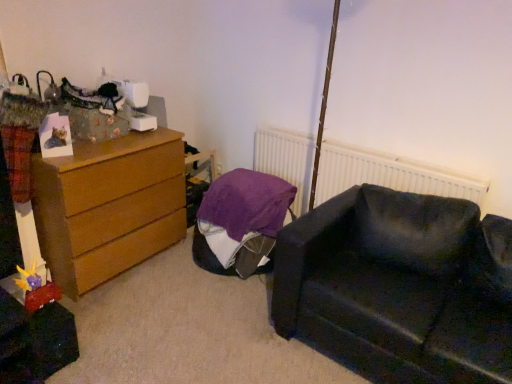
The height and width of the screenshot is (384, 512). Describe the element at coordinates (36, 289) in the screenshot. I see `plush yellow and purple toy at lower left` at that location.

Image resolution: width=512 pixels, height=384 pixels. What are the coordinates of `plush yellow and purple toy at lower left` in the screenshot? It's located at (36, 289).

Could you measure the distance between plush yellow and purple toy at lower left and white textured radiator at upper center?

plush yellow and purple toy at lower left and white textured radiator at upper center are 5.15 feet apart.

Can you confirm if plush yellow and purple toy at lower left is wider than white textured radiator at upper center?

Yes.

Image resolution: width=512 pixels, height=384 pixels. I want to click on toy beneath the white textured radiator at upper center (from a real-world perspective), so click(x=36, y=289).

In the image, is plush yellow and purple toy at lower left positioned in front of or behind white textured radiator at upper center?

plush yellow and purple toy at lower left is in front of white textured radiator at upper center.

Is purple fabric bean bag at center to the left or to the right of wooden chest of drawers at left in the image?

In the image, purple fabric bean bag at center appears on the right side of wooden chest of drawers at left.

Does purple fabric bean bag at center turn towards wooden chest of drawers at left?

No, purple fabric bean bag at center is not turned towards wooden chest of drawers at left.

Is point (212, 234) behind point (139, 151)?

Yes, it is behind point (139, 151).

Are purple fabric bean bag at center and wooden chest of drawers at left far apart?

No, purple fabric bean bag at center is in close proximity to wooden chest of drawers at left.

From the image's perspective, which one is positioned higher, dark fabric couch at lower right or white textured radiator at upper center?

From the image's view, white textured radiator at upper center is above.

Is dark fabric couch at lower right not near white textured radiator at upper center?

No, dark fabric couch at lower right is in close proximity to white textured radiator at upper center.

How many degrees apart are the facing directions of dark fabric couch at lower right and white textured radiator at upper center?

The angular difference between dark fabric couch at lower right and white textured radiator at upper center is 1.44 degrees.

From a real-world perspective, relative to white textured radiator at upper center, is dark fabric couch at lower right vertically above or below?

In terms of real-world spatial position, dark fabric couch at lower right is below white textured radiator at upper center.

This screenshot has height=384, width=512. In the image, there is a wooden chest of drawers at left. Find the location of `radiator above it (from the image's perspective)`. radiator above it (from the image's perspective) is located at coordinates (389, 174).

Which is behind, white textured radiator at upper center or wooden chest of drawers at left?

white textured radiator at upper center is further from the camera.

Is white textured radiator at upper center bigger or smaller than wooden chest of drawers at left?

Considering their sizes, white textured radiator at upper center takes up less space than wooden chest of drawers at left.

Is white textured radiator at upper center oriented towards wooden chest of drawers at left?

Yes.

Does plush yellow and purple toy at lower left contain wooden chest of drawers at left?

That's incorrect, wooden chest of drawers at left is not inside plush yellow and purple toy at lower left.

Is plush yellow and purple toy at lower left smaller than wooden chest of drawers at left?

Yes, plush yellow and purple toy at lower left is smaller than wooden chest of drawers at left.

Locate an element on the screen. The height and width of the screenshot is (384, 512). chest of drawers above the plush yellow and purple toy at lower left (from a real-world perspective) is located at coordinates (x=109, y=206).

Is plush yellow and purple toy at lower left further to camera compared to wooden chest of drawers at left?

No, the depth of plush yellow and purple toy at lower left is less than that of wooden chest of drawers at left.

Is purple fabric bean bag at center to the left or to the right of dark fabric couch at lower right in the image?

purple fabric bean bag at center is positioned on dark fabric couch at lower right's left side.

Considering the positions of objects purple fabric bean bag at center and dark fabric couch at lower right in the image provided, who is in front, purple fabric bean bag at center or dark fabric couch at lower right?

Positioned in front is dark fabric couch at lower right.

Does point (284, 201) come behind point (404, 239)?

Yes, it is.

In terms of height, does purple fabric bean bag at center look taller or shorter compared to dark fabric couch at lower right?

In the image, purple fabric bean bag at center appears to be shorter than dark fabric couch at lower right.

Which of these two, dark fabric couch at lower right or purple fabric bean bag at center, is bigger?

Bigger between the two is dark fabric couch at lower right.

From a real-world perspective, which object rests below the other?

purple fabric bean bag at center.

How many degrees apart are the facing directions of dark fabric couch at lower right and purple fabric bean bag at center?

They differ by 1.04 degrees in their facing directions.

Considering the relative sizes of dark fabric couch at lower right and purple fabric bean bag at center in the image provided, is dark fabric couch at lower right wider than purple fabric bean bag at center?

Yes.

Where is `toy lying on the left of white textured radiator at upper center`? This screenshot has width=512, height=384. toy lying on the left of white textured radiator at upper center is located at coordinates (36, 289).

At what (x,y) coordinates should I click in order to perform the action: click on bean bag chair directly beneath the wooden chest of drawers at left (from a real-world perspective). Please return your answer as a coordinate pair (x, y). Looking at the image, I should click on (242, 219).

From the image, which object appears to be farther from white textured radiator at upper center, wooden chest of drawers at left or purple fabric bean bag at center?

The object further to white textured radiator at upper center is wooden chest of drawers at left.

Based on their spatial positions, is purple fabric bean bag at center or wooden chest of drawers at left closer to white textured radiator at upper center?

Among the two, purple fabric bean bag at center is located nearer to white textured radiator at upper center.

Considering their positions, is white textured radiator at upper center positioned further to plush yellow and purple toy at lower left than wooden chest of drawers at left?

white textured radiator at upper center is positioned further to the anchor plush yellow and purple toy at lower left.

Considering their positions, is dark fabric couch at lower right positioned closer to purple fabric bean bag at center than plush yellow and purple toy at lower left?

Among the two, dark fabric couch at lower right is located nearer to purple fabric bean bag at center.

Considering their positions, is white textured radiator at upper center positioned closer to dark fabric couch at lower right than plush yellow and purple toy at lower left?

white textured radiator at upper center lies closer to dark fabric couch at lower right than the other object.

Estimate the real-world distances between objects in this image. Which object is further from purple fabric bean bag at center, plush yellow and purple toy at lower left or dark fabric couch at lower right?

Based on the image, plush yellow and purple toy at lower left appears to be further to purple fabric bean bag at center.

Which object lies nearer to the anchor point dark fabric couch at lower right, white textured radiator at upper center or wooden chest of drawers at left?

white textured radiator at upper center is positioned closer to the anchor dark fabric couch at lower right.

From the image, which object appears to be nearer to white textured radiator at upper center, plush yellow and purple toy at lower left or dark fabric couch at lower right?

The object closer to white textured radiator at upper center is dark fabric couch at lower right.

Where is `bean bag chair between plush yellow and purple toy at lower left and dark fabric couch at lower right from left to right`? This screenshot has height=384, width=512. bean bag chair between plush yellow and purple toy at lower left and dark fabric couch at lower right from left to right is located at coordinates (242, 219).

Locate an element on the screen. the chest of drawers situated between plush yellow and purple toy at lower left and white textured radiator at upper center from left to right is located at coordinates (109, 206).

This screenshot has width=512, height=384. Find the location of `the chest of drawers situated between plush yellow and purple toy at lower left and dark fabric couch at lower right from left to right`. the chest of drawers situated between plush yellow and purple toy at lower left and dark fabric couch at lower right from left to right is located at coordinates (109, 206).

Where is `radiator situated between wooden chest of drawers at left and dark fabric couch at lower right from left to right`? Image resolution: width=512 pixels, height=384 pixels. radiator situated between wooden chest of drawers at left and dark fabric couch at lower right from left to right is located at coordinates (389, 174).